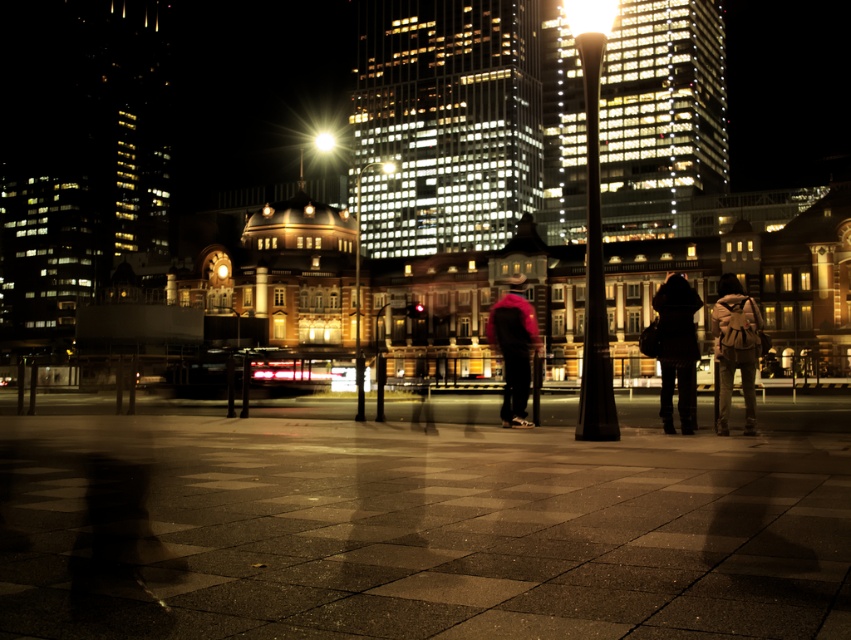
You are a delivery person who needs to place a package on the smooth concrete pavement at center. However, there is a brown leather backpack at center already occupying the space. Can you place the package there without moving the backpack?

The smooth concrete pavement at center is smaller than the brown leather backpack at center, so placing the package there without moving the backpack would not be possible because the backpack is larger and occupies more space than the pavement itself.

You are a photographer trying to capture the velvet pink sweater at center in your shot. However, the brown leather backpack at center is blocking your view. Can you adjust your angle to see the sweater without moving the backpack?

The brown leather backpack at center is positioned over the velvet pink sweater at center, so adjusting your angle might allow you to see the sweater underneath if you tilt your camera downward or move slightly to the side to avoid the backpack blocking the view.